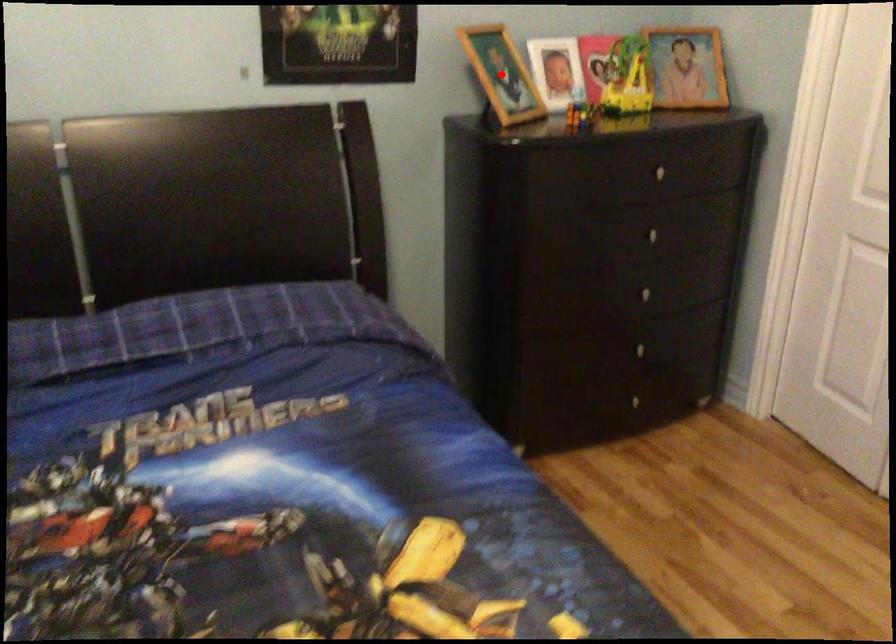
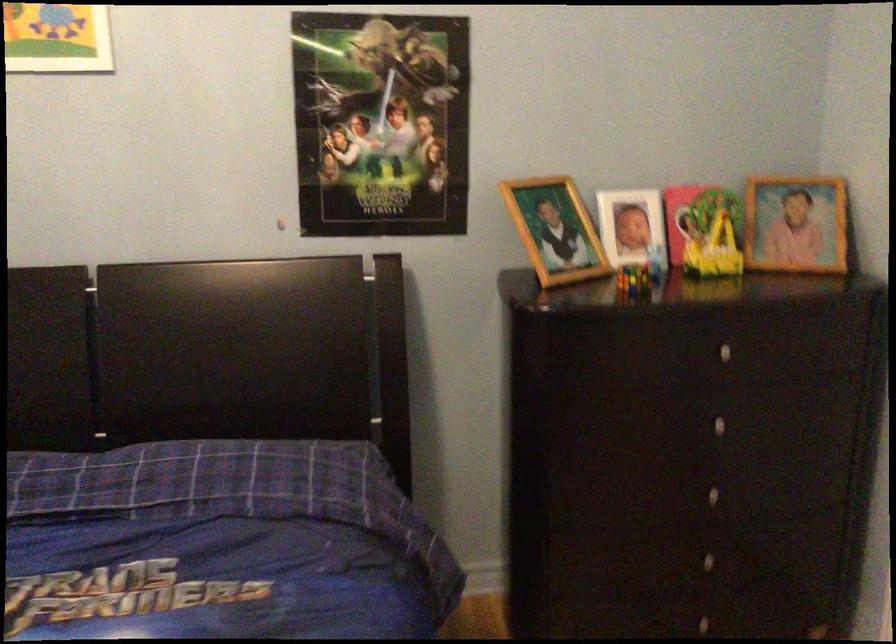
Question: I am providing you with two images of the same scene from different viewpoints. In image1, a red point is highlighted. Considering the same 3D point in image2, which of the following is correct?

Choices:
 (A) It is closer
 (B) It is farther

Answer: (A)